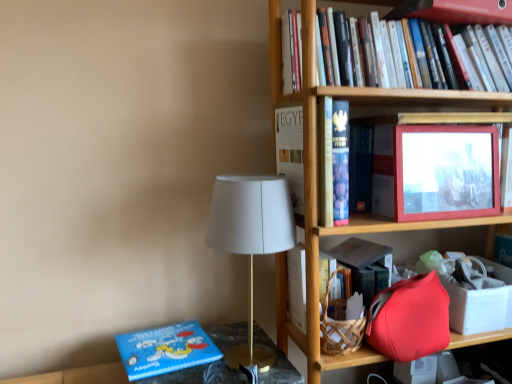
Question: Is blue matte board book at lower left, which is the second book in top-to-bottom order, at the right side of matte red picture frame at upper right?

Choices:
 (A) no
 (B) yes

Answer: (A)

Question: Are blue matte board book at lower left, which is the second book in top-to-bottom order, and matte red picture frame at upper right making contact?

Choices:
 (A) no
 (B) yes

Answer: (A)

Question: Can you confirm if blue matte board book at lower left, positioned as the first book in left-to-right order, is thinner than matte red picture frame at upper right?

Choices:
 (A) no
 (B) yes

Answer: (A)

Question: Considering the relative sizes of blue matte board book at lower left, positioned as the first book in bottom-to-top order, and matte red picture frame at upper right in the image provided, is blue matte board book at lower left, positioned as the first book in bottom-to-top order, wider than matte red picture frame at upper right?

Choices:
 (A) no
 (B) yes

Answer: (B)

Question: In terms of size, does matte red picture frame at upper right appear bigger or smaller than white matte table lamp at center?

Choices:
 (A) big
 (B) small

Answer: (B)

Question: In the image, is matte red picture frame at upper right positioned in front of or behind white matte table lamp at center?

Choices:
 (A) behind
 (B) front

Answer: (A)

Question: Which is correct: matte red picture frame at upper right is inside white matte table lamp at center, or outside of it?

Choices:
 (A) outside
 (B) inside

Answer: (A)

Question: Is matte red picture frame at upper right wider or thinner than white matte table lamp at center?

Choices:
 (A) thin
 (B) wide

Answer: (A)

Question: Based on their positions, is matte red picture frame at upper right located to the left or right of hardcover book at upper right, the second book from the left?

Choices:
 (A) left
 (B) right

Answer: (B)

Question: From the image's perspective, is matte red picture frame at upper right positioned above or below hardcover book at upper right, the first book when ordered from right to left?

Choices:
 (A) below
 (B) above

Answer: (A)

Question: Relative to hardcover book at upper right, the first book when ordered from right to left, is matte red picture frame at upper right in front or behind?

Choices:
 (A) front
 (B) behind

Answer: (B)

Question: From their relative heights in the image, would you say matte red picture frame at upper right is taller or shorter than hardcover book at upper right, which ranks as the second book in bottom-to-top order?

Choices:
 (A) short
 (B) tall

Answer: (B)

Question: From the image's perspective, is matte red picture frame at upper right above or below white matte box at right?

Choices:
 (A) below
 (B) above

Answer: (B)

Question: In the image, is matte red picture frame at upper right positioned in front of or behind white matte box at right?

Choices:
 (A) behind
 (B) front

Answer: (B)